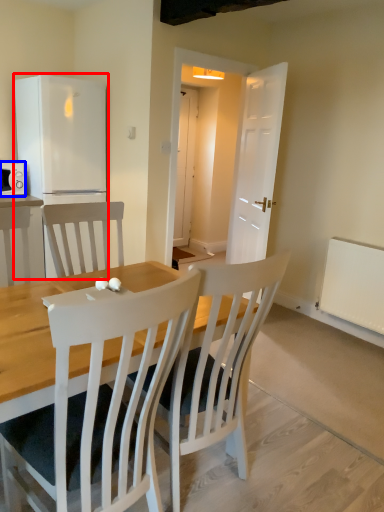
Question: Which point is closer to the camera, refrigerator (highlighted by a red box) or microwave oven (highlighted by a blue box)?

Choices:
 (A) refrigerator
 (B) microwave oven

Answer: (A)